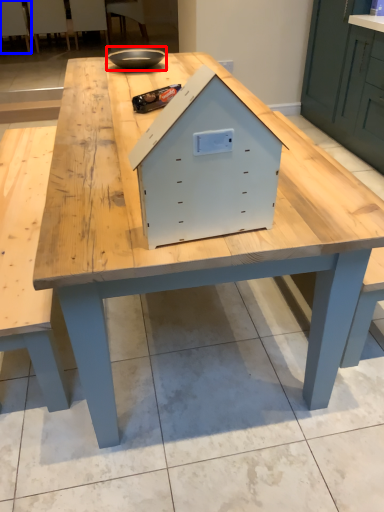
Question: Which object appears closest to the camera in this image, bowl (highlighted by a red box) or chair (highlighted by a blue box)?

Choices:
 (A) bowl
 (B) chair

Answer: (A)